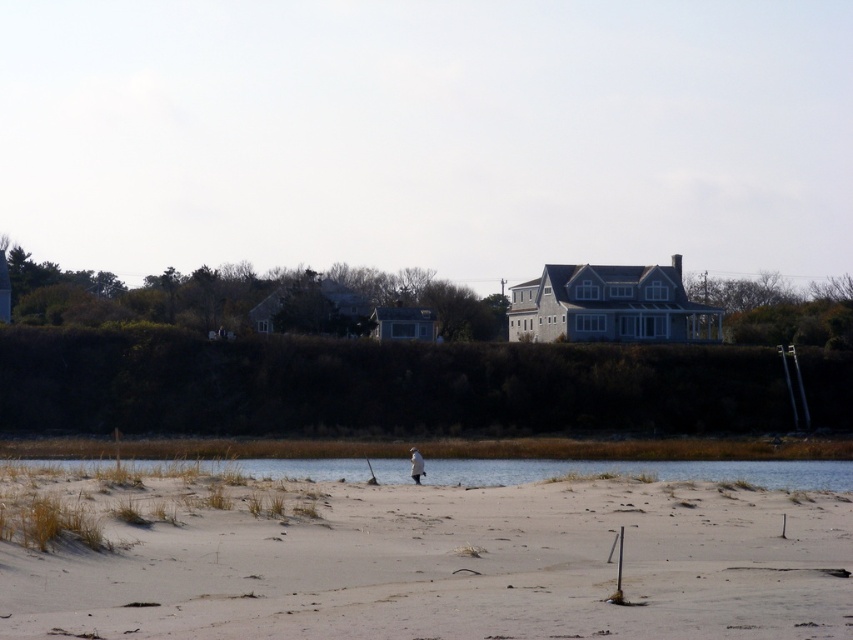
You are planning to set up a small tent on the white sandy beach at lower left and the clear water at lower center. Which location has enough space to accommodate the tent without overcrowding?

The clear water at lower center has a greater width than the white sandy beach at lower left, so it is more spacious and can accommodate the tent without overcrowding.

From the picture: You are standing on the beach and see a point marked at coordinates (416, 557). According to the scene description, what is located at that point?

The point at coordinates (416, 557) indicates a white sandy beach at lower left.

You are standing on the white sandy beach at lower left and want to reach the clear water at lower center. Which direction should you move to get there?

You should move downward from the white sandy beach at lower left to reach the clear water at lower center because the white sandy beach at lower left is above clear water at lower center.